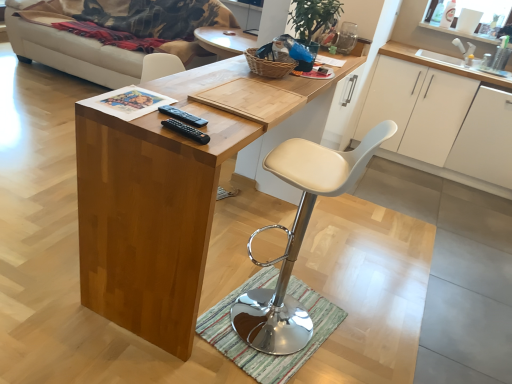
Locate an element on the screen. The height and width of the screenshot is (384, 512). free space above striped fabric doormat at lower center (from a real-world perspective) is located at coordinates (266, 321).